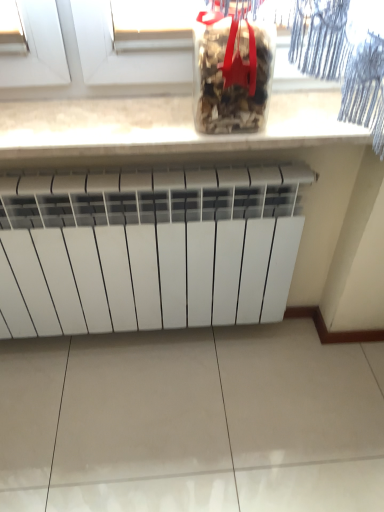
Question: In terms of size, does white stone countertop at upper center appear bigger or smaller than transparent plastic container at upper center?

Choices:
 (A) small
 (B) big

Answer: (B)

Question: From the image's perspective, is white stone countertop at upper center located above or below transparent plastic container at upper center?

Choices:
 (A) above
 (B) below

Answer: (B)

Question: Estimate the real-world distances between objects in this image. Which object is closer to the white matte radiator at center?

Choices:
 (A) white stone countertop at upper center
 (B) transparent plastic container at upper center

Answer: (A)

Question: Estimate the real-world distances between objects in this image. Which object is closer to the white matte radiator at center?

Choices:
 (A) transparent plastic container at upper center
 (B) white stone countertop at upper center

Answer: (B)